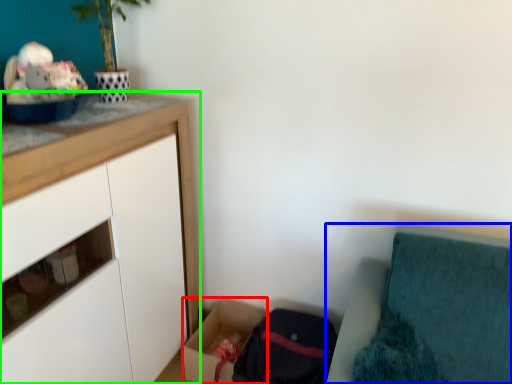
Question: Considering the real-world distances, which object is closest to storage box (highlighted by a red box)? furniture (highlighted by a blue box) or cabinetry (highlighted by a green box).

Choices:
 (A) furniture
 (B) cabinetry

Answer: (B)